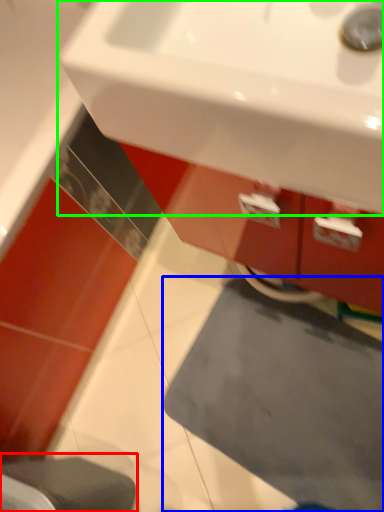
Question: Which object is the closest to the step stool (highlighted by a red box)? Choose among these: bath mat (highlighted by a blue box) or sink (highlighted by a green box).

Choices:
 (A) bath mat
 (B) sink

Answer: (A)